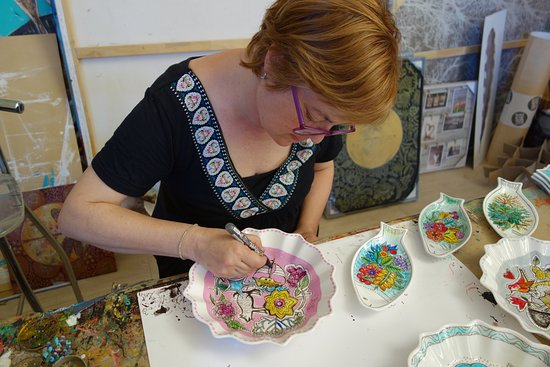
Where is `wooden floor`? The width and height of the screenshot is (550, 367). wooden floor is located at coordinates (104, 280).